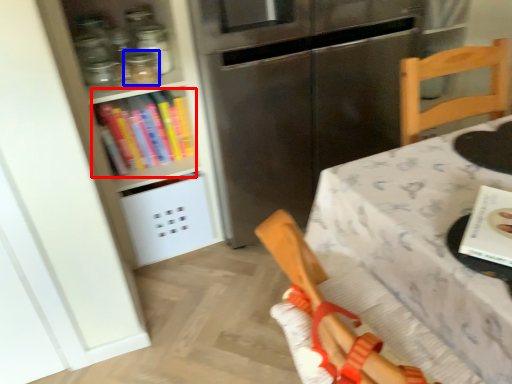
Question: Among these objects, which one is farthest to the camera, book (highlighted by a red box) or glass jar (highlighted by a blue box)?

Choices:
 (A) book
 (B) glass jar

Answer: (A)